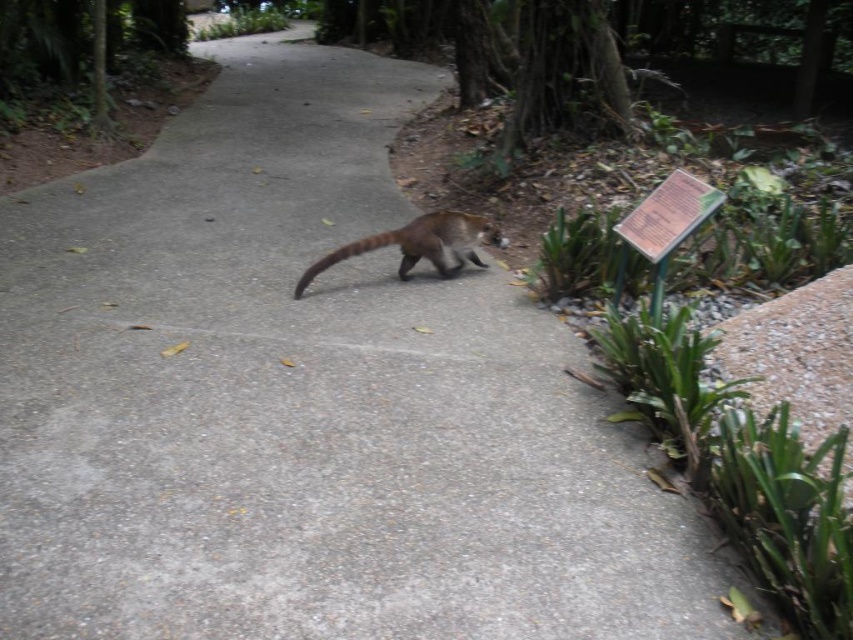
You are walking along the path and see the green plastic sign at right and the brown fuzzy tail at center. Which object is located to the right of the other?

The green plastic sign at right is positioned on the right side of brown fuzzy tail at center.

You are standing at the center of the concrete pathway in the park. There is a green plastic sign at right. Where is the green plastic sign located relative to the pathway?

The green plastic sign at right is located to the right side of the pathway, as its 2D coordinates at point (668, 214) place it on the right side relative to the pathway center.